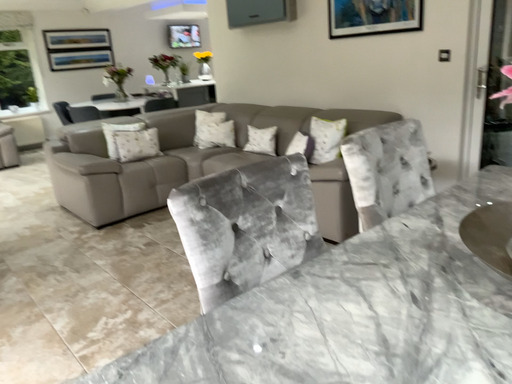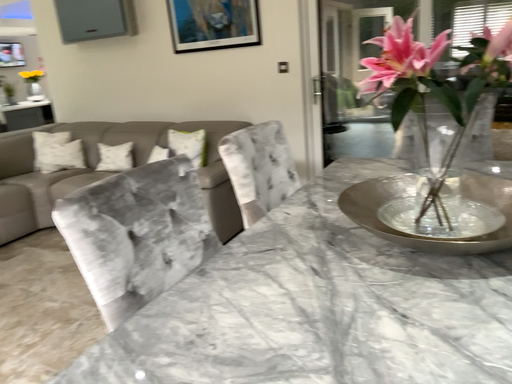
Question: Which way did the camera rotate in the video?

Choices:
 (A) rotated right
 (B) rotated left

Answer: (A)